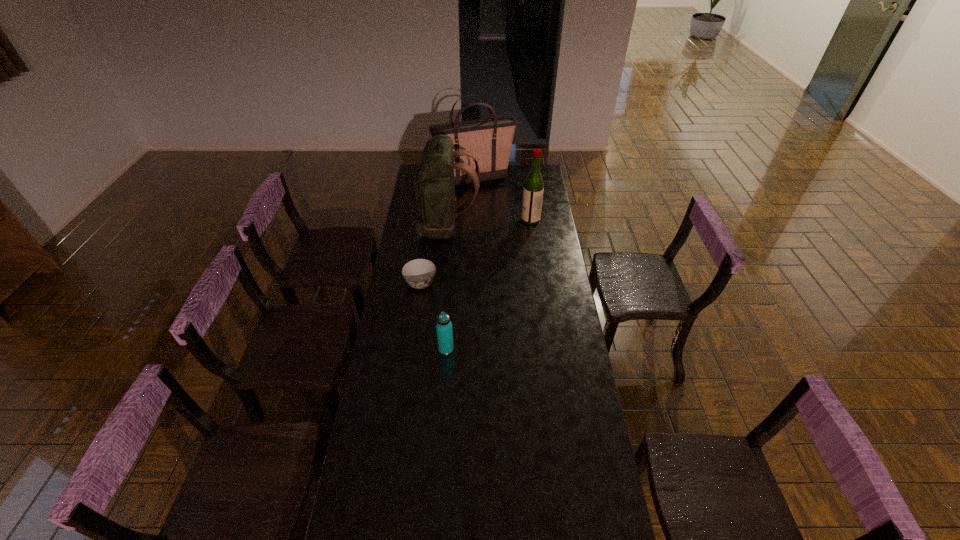
The height and width of the screenshot is (540, 960). I want to click on object at the far left corner, so click(489, 140).

This screenshot has height=540, width=960. I want to click on vacant space at the left edge, so click(x=358, y=509).

Identify the location of vacant area at the right edge. (593, 489).

You are a GUI agent. You are given a task and a screenshot of the screen. Output one action in this format:
    pyautogui.click(x=<x>, y=<y>)
    Task: Click on the unoccupied position between the rightmost object and the soup bowl
    
    Given the screenshot: What is the action you would take?
    pyautogui.click(x=475, y=252)

In order to click on free point between the fourth tallest object and the backpack in this screenshot , I will do `click(446, 288)`.

Locate an element on the screen. The image size is (960, 540). vacant area that lies between the soup bowl and the liquor is located at coordinates (475, 252).

Identify the location of vacant region between the liquor and the second shortest object. (489, 284).

Where is `vacant area between the fourth tallest object and the farthest object`? The image size is (960, 540). vacant area between the fourth tallest object and the farthest object is located at coordinates pos(460,264).

In order to click on object that stands as the fourth closest to the second nearest object in this screenshot , I will do `click(489, 140)`.

Where is `object that stands as the fourth closest to the second nearest object`? object that stands as the fourth closest to the second nearest object is located at coordinates (489, 140).